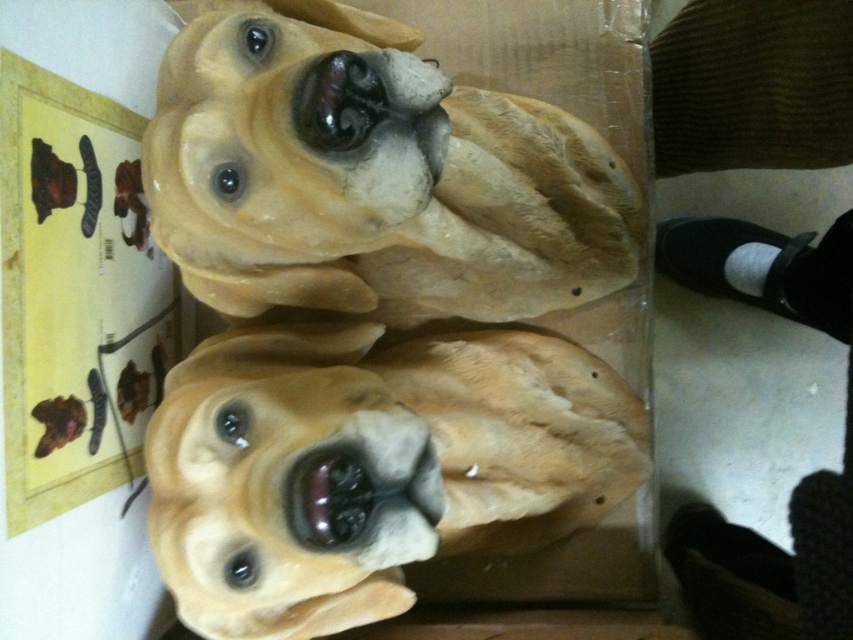
Question: Which point appears farthest from the camera in this image?

Choices:
 (A) (347, 561)
 (B) (273, 564)

Answer: (A)

Question: Can you confirm if matte clay dog heads at center is positioned to the right of matte brown dog at center?

Choices:
 (A) no
 (B) yes

Answer: (B)

Question: Which of the following is the farthest from the observer?

Choices:
 (A) (582, 125)
 (B) (256, 566)

Answer: (A)

Question: Where is matte clay dog heads at center located in relation to matte brown dog at center in the image?

Choices:
 (A) below
 (B) above

Answer: (B)

Question: Is matte clay dog heads at center positioned in front of matte brown dog at center?

Choices:
 (A) yes
 (B) no

Answer: (A)